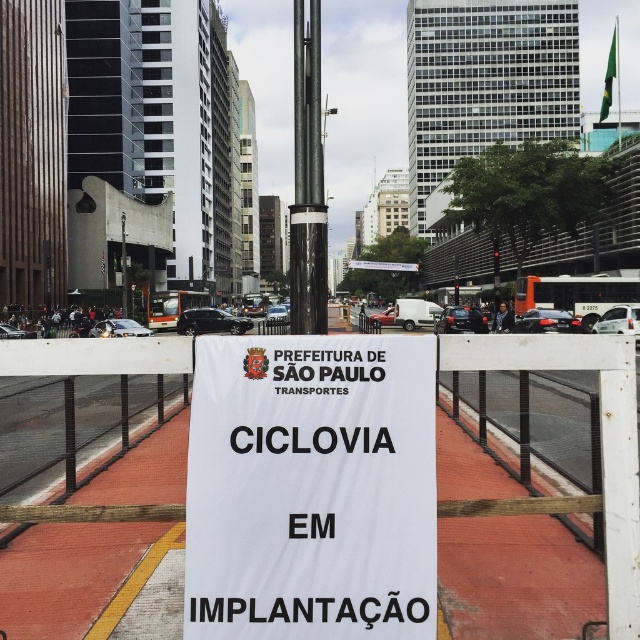
You are a delivery person with a 3.5 meter long trailer. You need to maneuver your trailer through the gap between the white mesh fence at center and the metallic pole at center. Can your trailer fit through the gap without any part of it touching either the fence or the pole?

The gap between the white mesh fence at center and the metallic pole at center is 3.67 meters. Since your trailer is 3.5 meters long, it can fit through the gap as the distance is slightly larger than the trailer length. However, ensure proper alignment to avoid contact with either obstacle.

You are a cyclist passing by the white paper sign at center and the white mesh fence at center. Which object is smaller in size?

The white paper sign at center is smaller in size compared to the white mesh fence at center.

You are a construction worker who needs to secure a safety net between the white mesh fence at center and the metallic pole at center. Considering their heights, which object will require a longer safety net? Please explain your reasoning.

The metallic pole at center is taller than the white mesh fence at center. Therefore, the safety net will need to be longer to cover the height of the metallic pole at center.